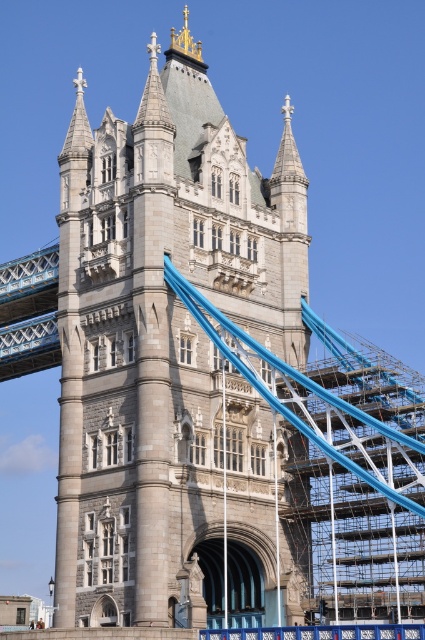
Question: Is gray stone tower at center to the right of blue metallic bridge at left from the viewer's perspective?

Choices:
 (A) yes
 (B) no

Answer: (A)

Question: Which object is farther from the camera taking this photo?

Choices:
 (A) gray stone tower at center
 (B) blue metallic bridge at left

Answer: (B)

Question: Among these points, which one is nearest to the camera?

Choices:
 (A) (65, 232)
 (B) (28, 353)

Answer: (A)

Question: Does gray stone tower at center appear under blue metallic bridge at left?

Choices:
 (A) yes
 (B) no

Answer: (B)

Question: Can you confirm if gray stone tower at center is bigger than blue metallic bridge at left?

Choices:
 (A) no
 (B) yes

Answer: (B)